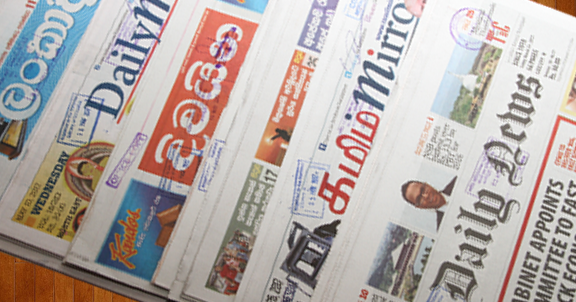
Locate an element on the screen. The height and width of the screenshot is (302, 576). news papers is located at coordinates (43, 61), (84, 121), (165, 137), (263, 169), (321, 181), (395, 221).